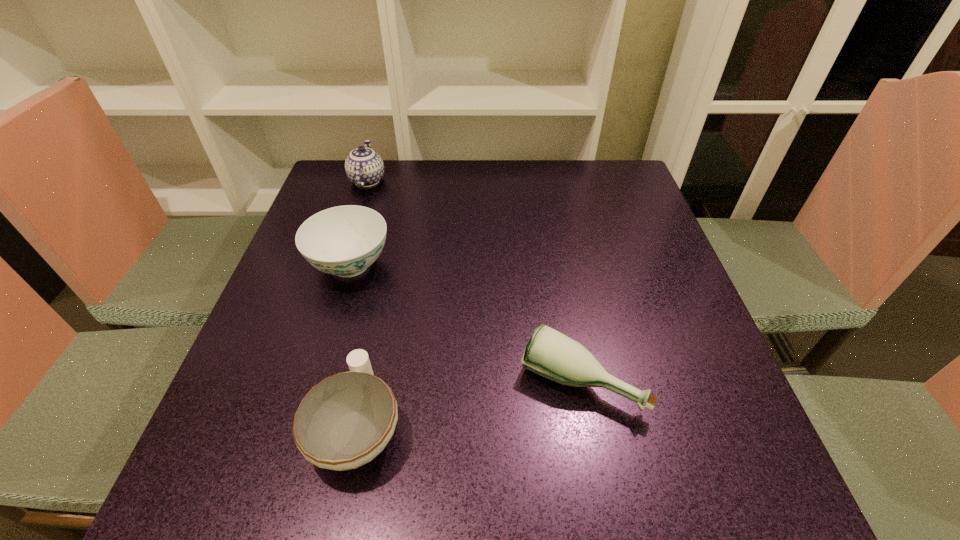
Find the location of a particular element. The height and width of the screenshot is (540, 960). vacant space in between the nearest chinaware and the third nearest object is located at coordinates (354, 346).

You are a GUI agent. You are given a task and a screenshot of the screen. Output one action in this format:
    pyautogui.click(x=<x>, y=<y>)
    Task: Click on the free space between the rightmost object and the nearest chinaware
    This screenshot has width=960, height=540.
    Given the screenshot: What is the action you would take?
    pyautogui.click(x=468, y=403)

The height and width of the screenshot is (540, 960). I want to click on free space between the shortest chinaware and the second farthest object, so click(x=354, y=346).

Image resolution: width=960 pixels, height=540 pixels. In order to click on free space between the rightmost object and the farthest object in this screenshot , I will do [x=474, y=280].

Identify the location of free spot between the farthest object and the nearest chinaware. This screenshot has width=960, height=540. (363, 303).

Where is `free spot between the rightmost object and the shortest chinaware`? free spot between the rightmost object and the shortest chinaware is located at coordinates (468, 403).

The width and height of the screenshot is (960, 540). Identify the location of unoccupied area between the bottle and the second nearest chinaware. [466, 322].

I want to click on vacant point located between the nearest chinaware and the farthest chinaware, so click(363, 303).

Locate an element on the screen. object identified as the second closest to the nearest chinaware is located at coordinates (345, 240).

Find the location of a particular element. The width and height of the screenshot is (960, 540). object that stands as the second closest to the second farthest chinaware is located at coordinates (345, 421).